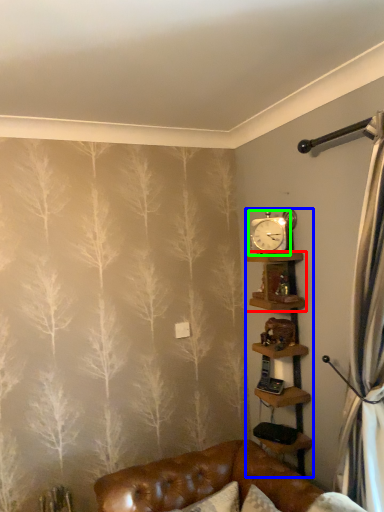
Question: Based on their relative distances, which object is farther from shelf (highlighted by a red box)? Choose from shelf (highlighted by a blue box) and clock (highlighted by a green box).

Choices:
 (A) shelf
 (B) clock

Answer: (A)